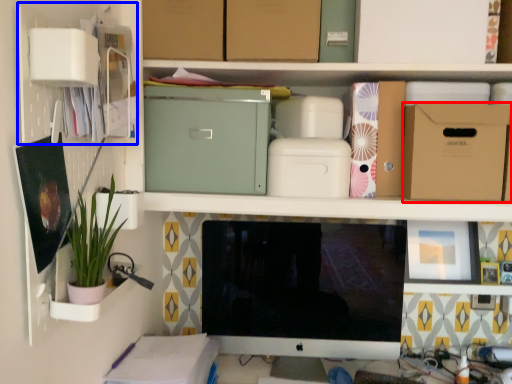
Question: Which point is closer to the camera, cardboard box (highlighted by a red box) or cabinet (highlighted by a blue box)?

Choices:
 (A) cardboard box
 (B) cabinet

Answer: (B)